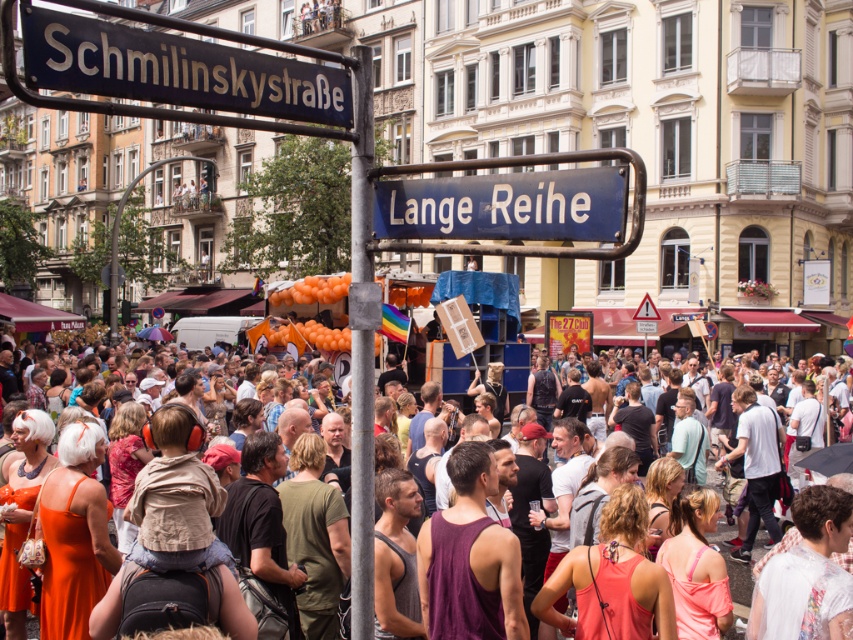
You are a tourist holding a map that shows a blue metallic street sign at upper center located at coordinates point 0.322, 0.593. You want to locate this sign in the current image. Where should you look?

You should look at point (505,205) to find the blue metallic street sign at upper center.